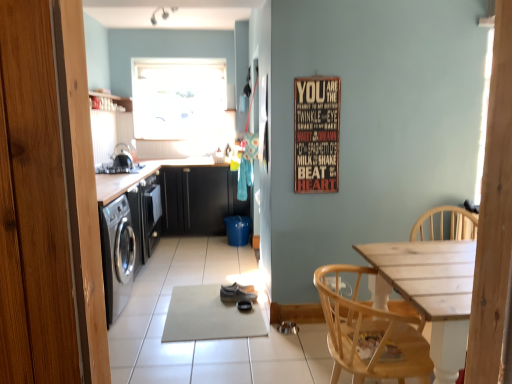
Question: Is satin black stove at upper left facing away from black matte cabinetry at left, which is the second cabinetry from back to front?

Choices:
 (A) yes
 (B) no

Answer: (B)

Question: Is satin black stove at upper left in front of black matte cabinetry at left, which is the second cabinetry from back to front?

Choices:
 (A) yes
 (B) no

Answer: (B)

Question: Is satin black stove at upper left thinner than black matte cabinetry at left, which is the second cabinetry from back to front?

Choices:
 (A) yes
 (B) no

Answer: (A)

Question: Considering the relative sizes of satin black stove at upper left and black matte cabinetry at left, which is the second cabinetry from back to front, in the image provided, is satin black stove at upper left bigger than black matte cabinetry at left, which is the second cabinetry from back to front,?

Choices:
 (A) yes
 (B) no

Answer: (B)

Question: From a real-world perspective, is satin black stove at upper left on top of black matte cabinetry at left, the 1th cabinetry from the front?

Choices:
 (A) no
 (B) yes

Answer: (B)

Question: From a real-world perspective, is satin black stove at upper left positioned above or below black matte cabinet at center, which is the first cabinetry from back to front?

Choices:
 (A) above
 (B) below

Answer: (A)

Question: Is satin black stove at upper left spatially inside black matte cabinet at center, the 2th cabinetry viewed from the front, or outside of it?

Choices:
 (A) outside
 (B) inside

Answer: (A)

Question: Based on their sizes in the image, would you say satin black stove at upper left is bigger or smaller than black matte cabinet at center, which is the first cabinetry from back to front?

Choices:
 (A) big
 (B) small

Answer: (B)

Question: Considering the positions of satin black stove at upper left and black matte cabinet at center, which is the first cabinetry from back to front, in the image, is satin black stove at upper left wider or thinner than black matte cabinet at center, which is the first cabinetry from back to front,?

Choices:
 (A) thin
 (B) wide

Answer: (A)

Question: From the image's perspective, is wooden signboard at upper right above or below black matte cabinet at center, which is the first cabinetry from back to front?

Choices:
 (A) below
 (B) above

Answer: (B)

Question: Looking at the image, does wooden signboard at upper right seem bigger or smaller compared to black matte cabinet at center, which is the first cabinetry from back to front?

Choices:
 (A) big
 (B) small

Answer: (B)

Question: From a real-world perspective, is wooden signboard at upper right physically located above or below black matte cabinet at center, which is the first cabinetry from back to front?

Choices:
 (A) below
 (B) above

Answer: (B)

Question: In the image, is wooden signboard at upper right positioned in front of or behind black matte cabinet at center, which is the first cabinetry from back to front?

Choices:
 (A) front
 (B) behind

Answer: (A)

Question: From their relative heights in the image, would you say light wood chair at lower right is taller or shorter than black matte cabinet at center, the 2th cabinetry viewed from the front?

Choices:
 (A) tall
 (B) short

Answer: (B)

Question: From the image's perspective, is light wood chair at lower right above or below black matte cabinet at center, the 2th cabinetry viewed from the front?

Choices:
 (A) above
 (B) below

Answer: (B)